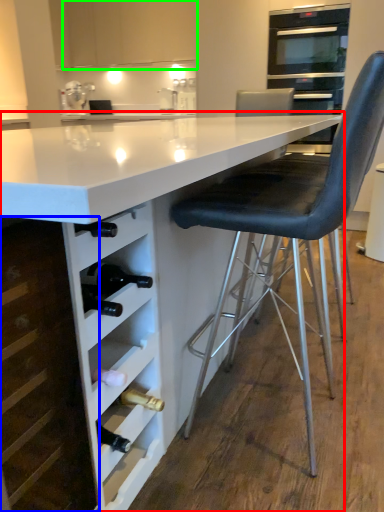
Question: Which object is positioned farthest from table (highlighted by a red box)? Select from cabinetry (highlighted by a blue box) and cabinetry (highlighted by a green box).

Choices:
 (A) cabinetry
 (B) cabinetry

Answer: (B)